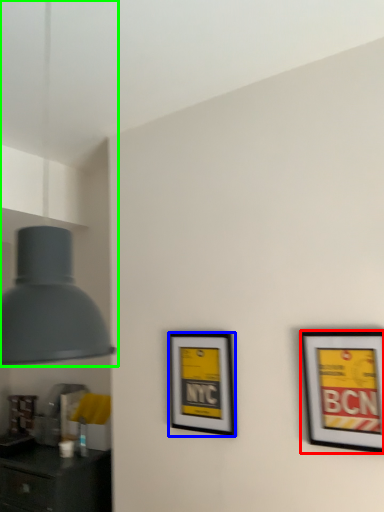
Question: Based on their relative distances, which object is nearer to picture frame (highlighted by a red box)? Choose from picture frame (highlighted by a blue box) and lamp (highlighted by a green box).

Choices:
 (A) picture frame
 (B) lamp

Answer: (A)